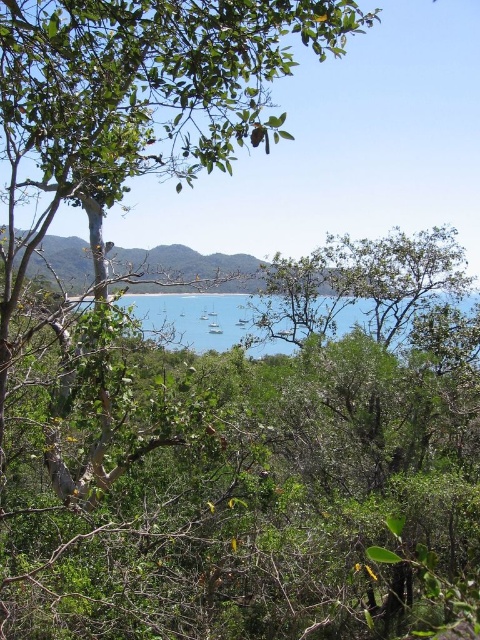
Can you confirm if green leafy tree at upper left is smaller than blue water at center?

Indeed, green leafy tree at upper left has a smaller size compared to blue water at center.

Is green leafy tree at upper left wider than blue water at center?

Incorrect, green leafy tree at upper left's width does not surpass blue water at center's.

Which is behind, point (265, 4) or point (222, 333)?

Point (222, 333)

Where is `green leafy tree at upper left`? This screenshot has height=640, width=480. green leafy tree at upper left is located at coordinates (139, 100).